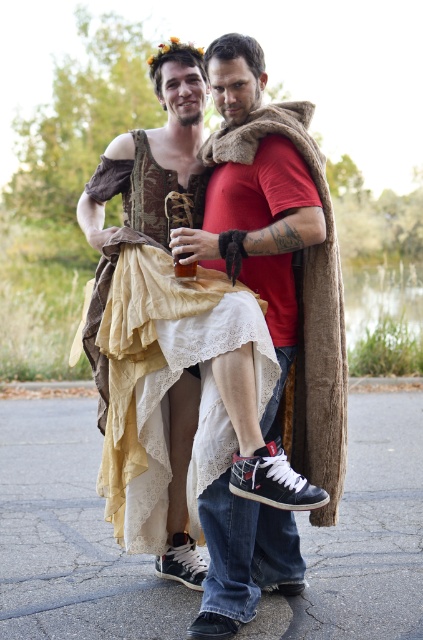
You are standing at point (x=173, y=256) and want to walk to the person on the right. Is point (x=96, y=332) behind you or in front of you?

Point (x=96, y=332) is behind point (x=173, y=256), so it is behind you.

You are standing at the center of the image and want to locate the matte brown fabric dress at center. Which direction should you look to find it?

The matte brown fabric dress at center is located at point 0.583 on the x axis and 0.489 on the y axis, so you should look towards the center of the image to find it.